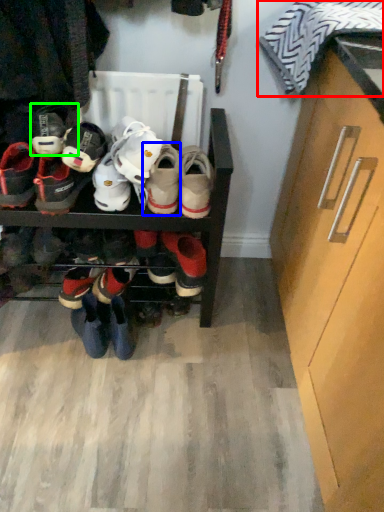
Question: Based on their relative distances, which object is nearer to clothing (highlighted by a red box)? Choose from footwear (highlighted by a blue box) and footwear (highlighted by a green box).

Choices:
 (A) footwear
 (B) footwear

Answer: (A)